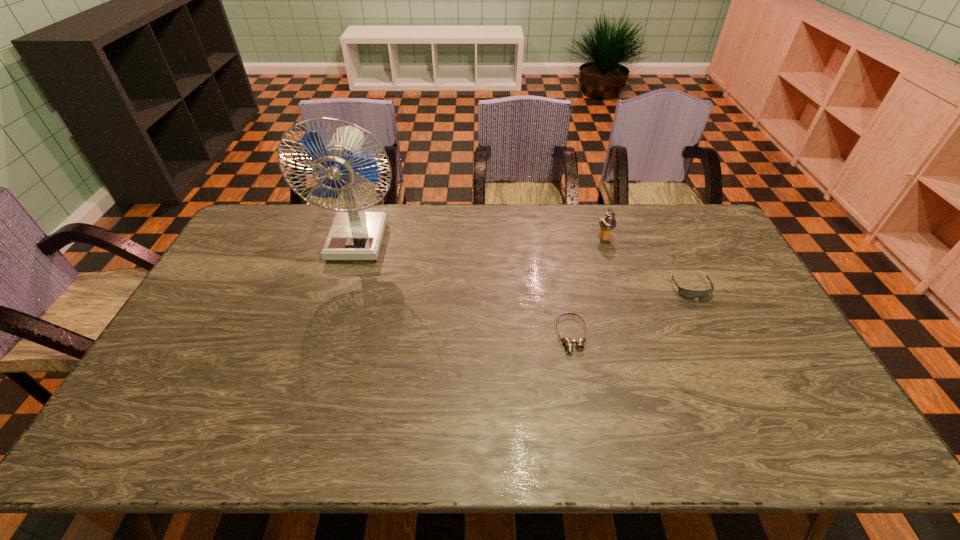
Identify the location of the leftmost object. This screenshot has width=960, height=540. (355, 235).

In order to click on fan in this screenshot , I will do `click(355, 235)`.

Where is `icecream`? This screenshot has width=960, height=540. icecream is located at coordinates click(x=607, y=223).

Where is `the third shortest object`? The height and width of the screenshot is (540, 960). the third shortest object is located at coordinates (607, 223).

In order to click on the third tallest object in this screenshot , I will do `click(686, 293)`.

Identify the location of the farther goggles. This screenshot has height=540, width=960. 686,293.

Where is `the nearer goggles`? The height and width of the screenshot is (540, 960). the nearer goggles is located at coordinates (568, 342).

Where is `the second object from left to right`? the second object from left to right is located at coordinates (568, 342).

What are the coordinates of `vacant space situated 0.090m on the front-facing side of the leftmost object` in the screenshot? It's located at pyautogui.click(x=345, y=282).

Locate an element on the screen. vacant space located 0.120m on the front of the second tallest object is located at coordinates (613, 267).